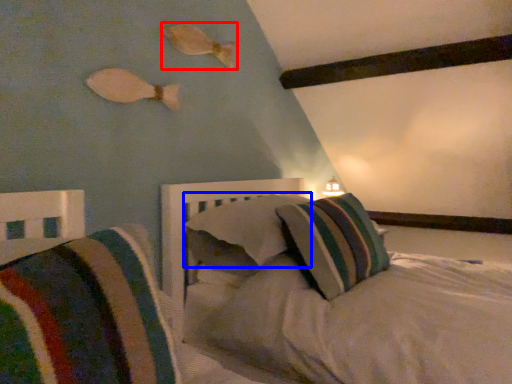
Question: Which object is further to the camera taking this photo, fish (highlighted by a red box) or pillow (highlighted by a blue box)?

Choices:
 (A) fish
 (B) pillow

Answer: (A)